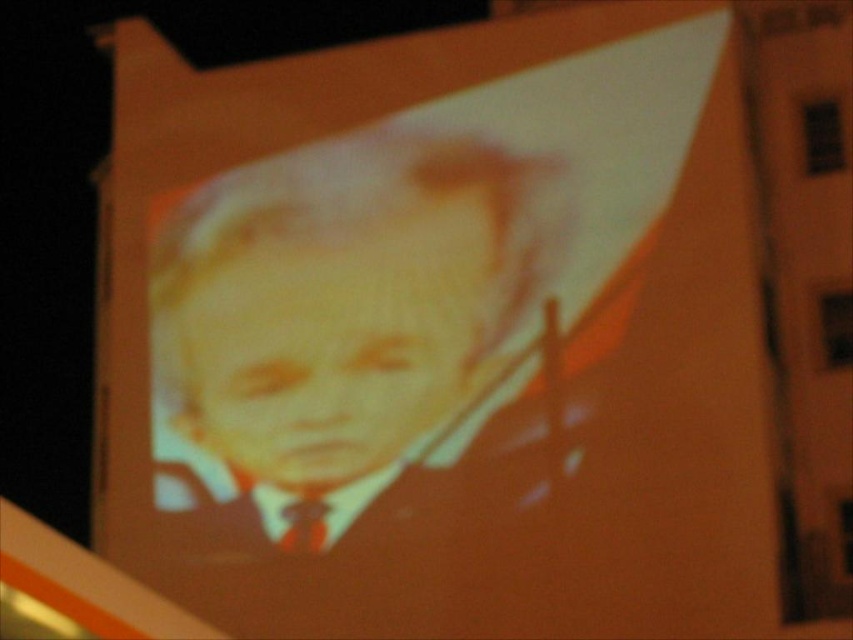
Which is below, smooth orange face at center or matte brown tie at lower center?

Positioned lower is matte brown tie at lower center.

Measure the distance between smooth orange face at center and camera.

A distance of 66.56 meters exists between smooth orange face at center and camera.

The height and width of the screenshot is (640, 853). I want to click on smooth orange face at center, so click(x=323, y=353).

Where is `matte yellow portrait at center`? This screenshot has width=853, height=640. matte yellow portrait at center is located at coordinates (344, 308).

Which is behind, point (277, 321) or point (314, 522)?

Point (277, 321)

Locate an element on the screen. The image size is (853, 640). matte yellow portrait at center is located at coordinates tap(344, 308).

Does matte yellow portrait at center come behind smooth orange face at center?

No, matte yellow portrait at center is in front of smooth orange face at center.

The width and height of the screenshot is (853, 640). In order to click on matte yellow portrait at center in this screenshot , I will do `click(344, 308)`.

Is point (474, 157) positioned in front of point (338, 484)?

No, (474, 157) is further to viewer.

Find the location of `matte yellow portrait at center`. matte yellow portrait at center is located at coordinates (344, 308).